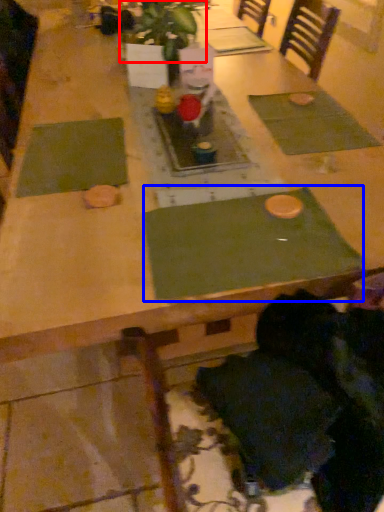
Question: Which object is closer to the camera taking this photo, plant (highlighted by a red box) or place mat (highlighted by a blue box)?

Choices:
 (A) plant
 (B) place mat

Answer: (B)